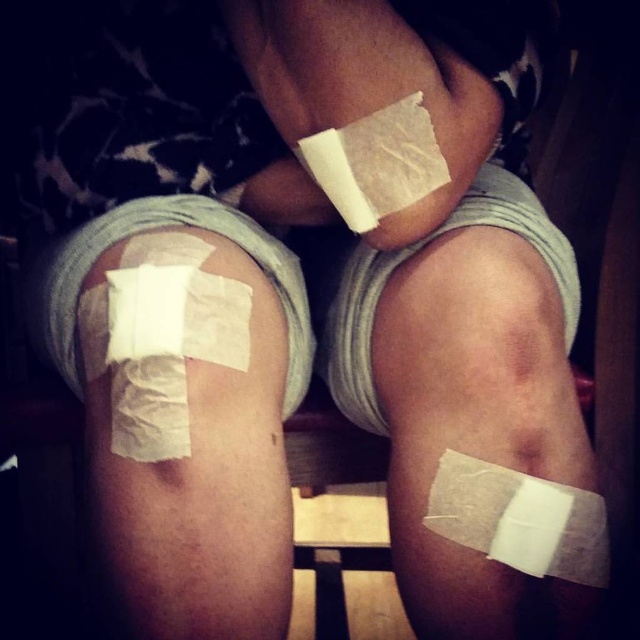
How much distance is there between white matte bandage at upper center and white matte bandage at lower right?

white matte bandage at upper center is 6.71 inches away from white matte bandage at lower right.

In the scene shown: Between white matte bandage at upper center and white matte bandage at lower right, which one appears on the left side from the viewer's perspective?

From the viewer's perspective, white matte bandage at upper center appears more on the left side.

This screenshot has width=640, height=640. I want to click on white matte bandage at upper center, so click(x=364, y=86).

Is white matte bandage at center wider than white matte bandage at lower left?

Indeed, white matte bandage at center has a greater width compared to white matte bandage at lower left.

Which of these two, white matte bandage at center or white matte bandage at lower left, stands shorter?

With less height is white matte bandage at lower left.

Between point (396, 394) and point (120, 397), which one is positioned in front?

Positioned in front is point (120, 397).

The image size is (640, 640). In order to click on white matte bandage at center in this screenshot , I will do `click(460, 380)`.

Consider the image. Can you confirm if white matte bandage at center is smaller than white matte bandage at lower right?

No.

Is the position of white matte bandage at center less distant than that of white matte bandage at lower right?

No.

Is point (413, 301) closer to viewer compared to point (451, 518)?

No, it is behind (451, 518).

The image size is (640, 640). What are the coordinates of `white matte bandage at center` in the screenshot? It's located at click(x=460, y=380).